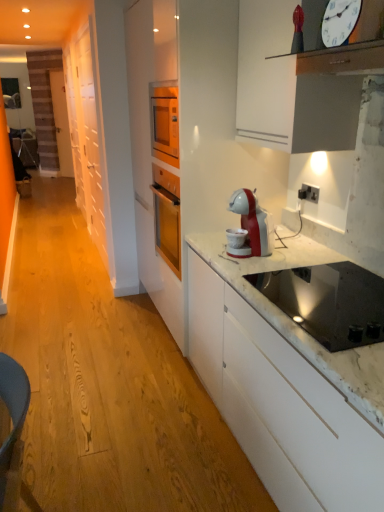
Question: Is black glass cooktop at lower right to the left of white plastic electric outlet at upper right from the viewer's perspective?

Choices:
 (A) yes
 (B) no

Answer: (A)

Question: Is black glass cooktop at lower right next to white plastic electric outlet at upper right and touching it?

Choices:
 (A) yes
 (B) no

Answer: (B)

Question: From the image's perspective, is black glass cooktop at lower right beneath white plastic electric outlet at upper right?

Choices:
 (A) no
 (B) yes

Answer: (B)

Question: Is the position of black glass cooktop at lower right less distant than that of white plastic electric outlet at upper right?

Choices:
 (A) yes
 (B) no

Answer: (A)

Question: Considering the relative sizes of black glass cooktop at lower right and white plastic electric outlet at upper right in the image provided, is black glass cooktop at lower right thinner than white plastic electric outlet at upper right?

Choices:
 (A) yes
 (B) no

Answer: (B)

Question: Is the position of black glass cooktop at lower right more distant than that of white plastic electric outlet at upper right?

Choices:
 (A) yes
 (B) no

Answer: (B)

Question: Can you see white plastic electric outlet at upper right touching white matte cabinet at left?

Choices:
 (A) no
 (B) yes

Answer: (A)

Question: From a real-world perspective, is white plastic electric outlet at upper right under white matte cabinet at left?

Choices:
 (A) no
 (B) yes

Answer: (A)

Question: Is white plastic electric outlet at upper right at the right side of white matte cabinet at left?

Choices:
 (A) no
 (B) yes

Answer: (B)

Question: Is white plastic electric outlet at upper right closer to camera compared to white matte cabinet at left?

Choices:
 (A) yes
 (B) no

Answer: (A)

Question: Is white plastic electric outlet at upper right shorter than white matte cabinet at left?

Choices:
 (A) yes
 (B) no

Answer: (A)

Question: Can you confirm if white plastic electric outlet at upper right is smaller than white matte cabinet at left?

Choices:
 (A) no
 (B) yes

Answer: (B)

Question: Considering the relative positions of white plastic clock at upper right and black glass cooktop at lower right in the image provided, is white plastic clock at upper right in front of black glass cooktop at lower right?

Choices:
 (A) no
 (B) yes

Answer: (B)